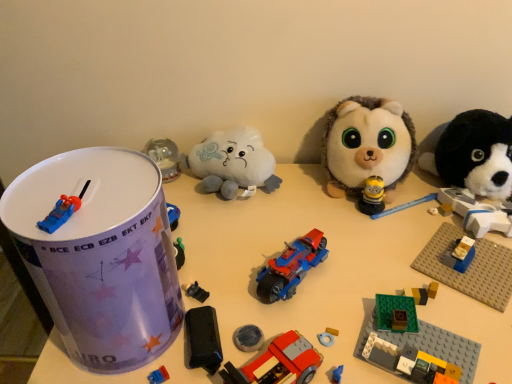
The image size is (512, 384). What are the coordinates of `vacant area that lies between white plush cloud at center, which is the third toy in left-to-right order, and black plastic toy car at center, placed as the fourth toy when sorted from left to right` in the screenshot? It's located at (219, 238).